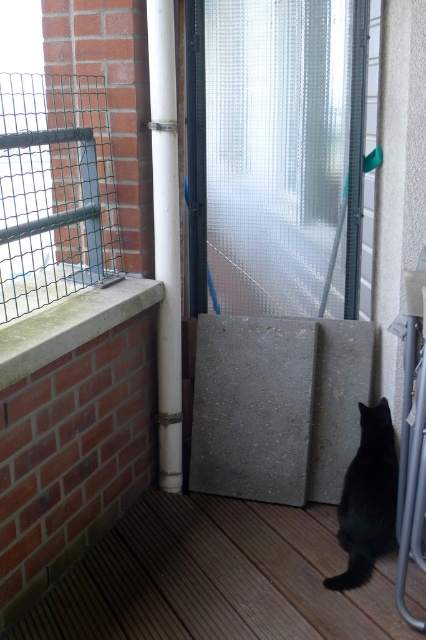
Does concrete/stone step at center appear on the left side of green wire mesh at upper left?

Incorrect, concrete/stone step at center is not on the left side of green wire mesh at upper left.

Where is `concrete/stone step at center`? The height and width of the screenshot is (640, 426). concrete/stone step at center is located at coordinates (276, 406).

In order to click on concrete/stone step at center in this screenshot , I will do `click(276, 406)`.

Who is more distant from viewer, (32, 115) or (123, 316)?

The point (32, 115) is behind.

Is green wire mesh at upper left to the right of concrete ledge at upper left from the viewer's perspective?

No, green wire mesh at upper left is not to the right of concrete ledge at upper left.

This screenshot has height=640, width=426. What do you see at coordinates (54, 189) in the screenshot?
I see `green wire mesh at upper left` at bounding box center [54, 189].

Locate an element on the screen. The height and width of the screenshot is (640, 426). green wire mesh at upper left is located at coordinates coord(54,189).

Is green wire mesh at upper left bigger than white plastic pipe at center?

Yes.

Is green wire mesh at upper left to the left of white plastic pipe at center from the viewer's perspective?

Yes, green wire mesh at upper left is to the left of white plastic pipe at center.

At what (x,y) coordinates should I click in order to perform the action: click on green wire mesh at upper left. Please return your answer as a coordinate pair (x, y). This screenshot has width=426, height=640. Looking at the image, I should click on (54, 189).